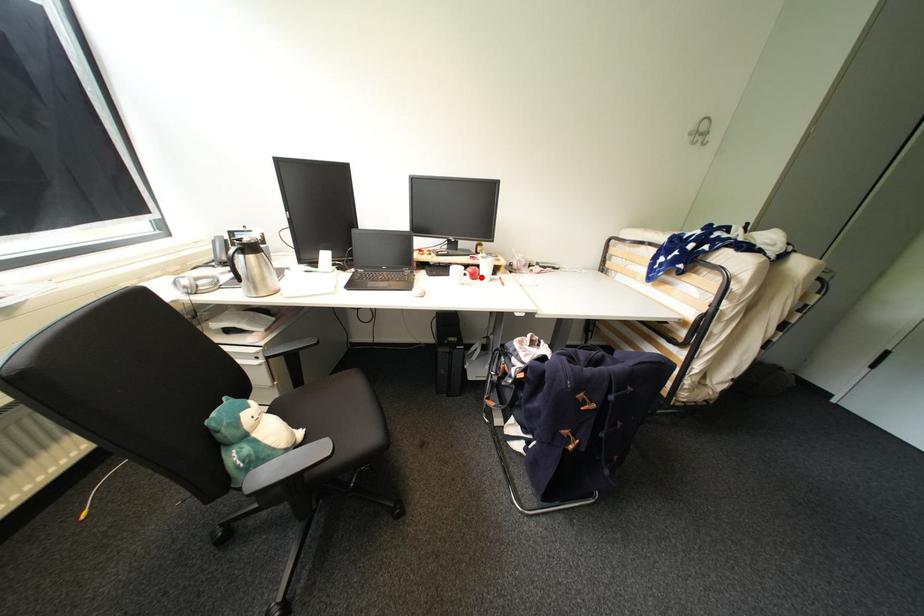
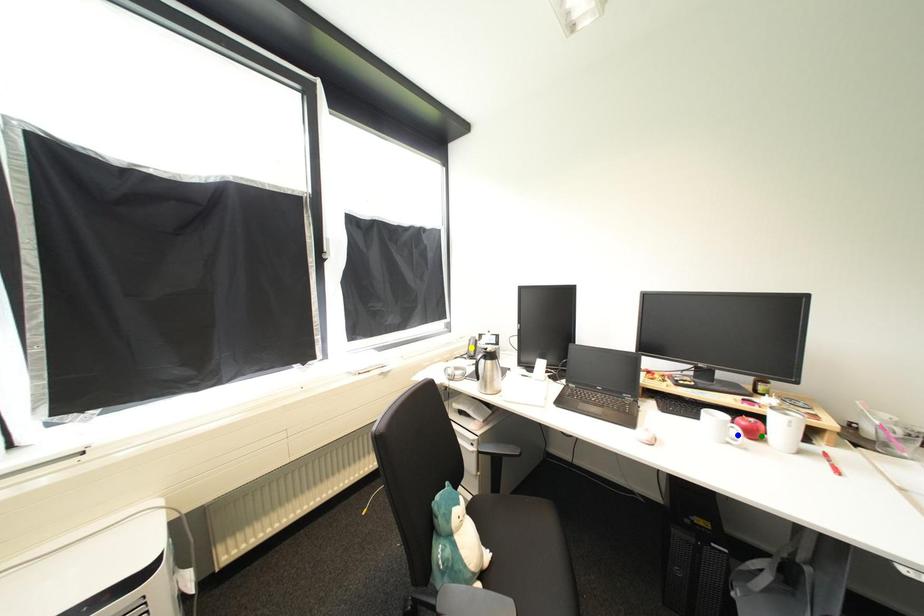
Question: I am providing you with two images of the same scene from different viewpoints. A red point is marked on the first image. You are given multiple points on the second image. Can you choose the point in image 2 that corresponds to the point in image 1?

Choices:
 (A) yellow point
 (B) blue point
 (C) green point

Answer: (C)